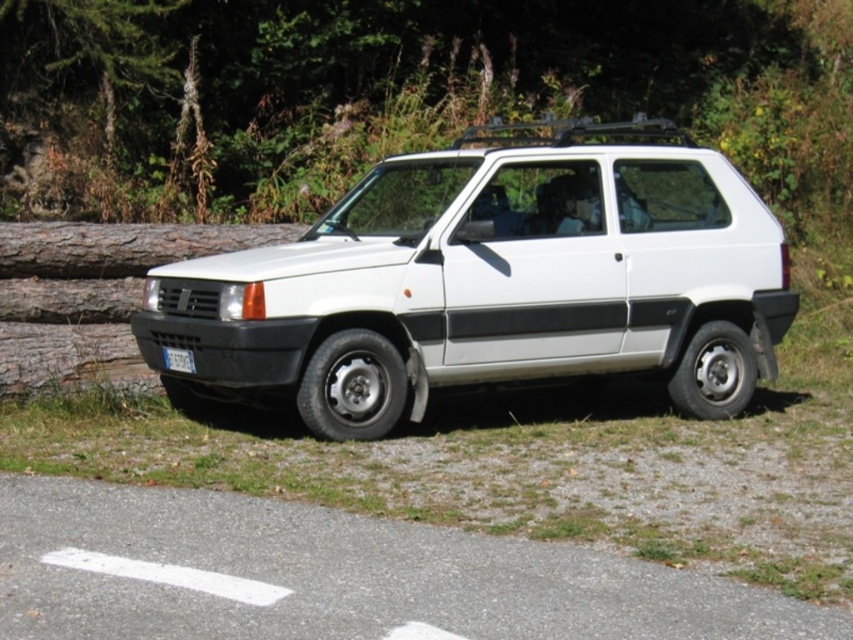
Does white matte suv at center have a greater height compared to white plastic license plate at lower left?

Yes.

Between point (289, 300) and point (170, 353), which one is positioned behind?

The point (170, 353) is behind.

Locate an element on the screen. The width and height of the screenshot is (853, 640). white matte suv at center is located at coordinates (490, 284).